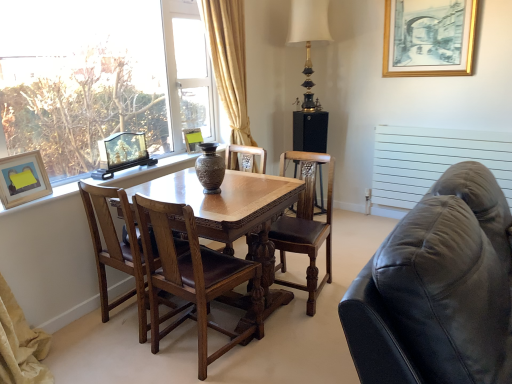
Identify the location of vacant space to the right of brown leather chair at center, marked as the 2th chair in a right-to-left arrangement. This screenshot has width=512, height=384. (286, 350).